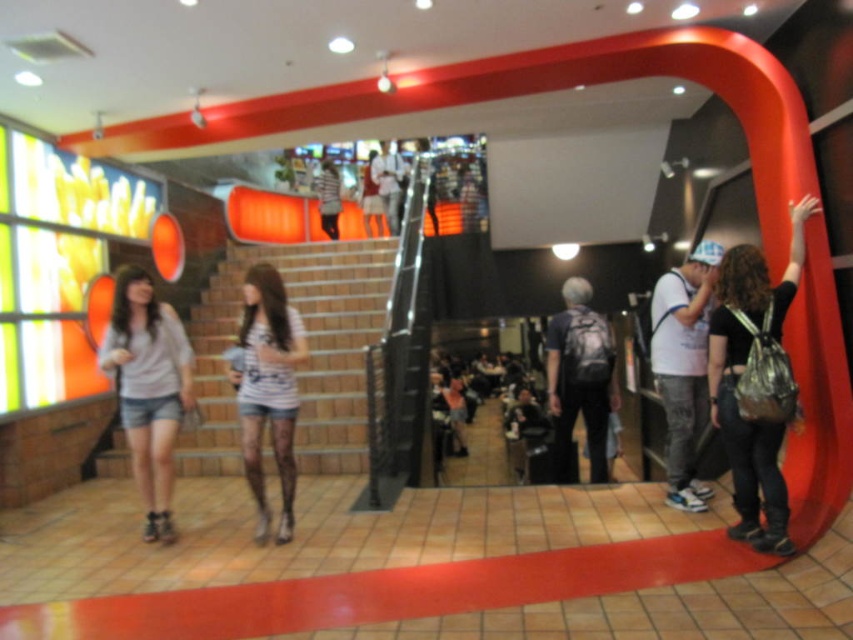
You are standing at the base of the staircase in the shopping mall and see two points marked in the scene. The first point is at coordinates point [247,248] and the second is at point [677,365]. Which point is closer to your current position?

Point [247,248] is further to the camera than point [677,365]. Therefore, point [677,365] is closer to your current position.

You are a photographer planning to capture a candid shot of the white striped shirt at center and the black matte backpack at right. You want to ensure both subjects are in focus. Considering their sizes, which object should you prioritize focusing on first to maximize clarity?

The black matte backpack at right has a greater width than the white striped shirt at center, so focusing on the backpack first would help ensure both are in focus as it occupies more space in the frame.

You are standing in the shopping mall and see the black matte backpack at right and the denim shorts at left. Which object is closer to you?

The black matte backpack at right is closer to you because it is in front of the denim shorts at left.